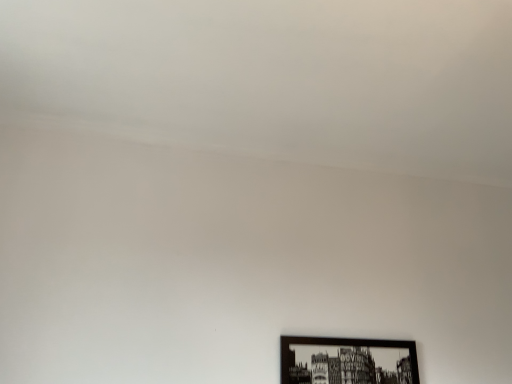
Locate an element on the screen. black matte picture frame at lower center is located at coordinates (347, 361).

Measure the distance between black matte picture frame at lower center and camera.

black matte picture frame at lower center is 1.55 meters from camera.

What is the approximate height of black matte picture frame at lower center?

It is 6.71 inches.

What do you see at coordinates (347, 361) in the screenshot? I see `black matte picture frame at lower center` at bounding box center [347, 361].

At what (x,y) coordinates should I click in order to perform the action: click on black matte picture frame at lower center. Please return your answer as a coordinate pair (x, y). The height and width of the screenshot is (384, 512). Looking at the image, I should click on (347, 361).